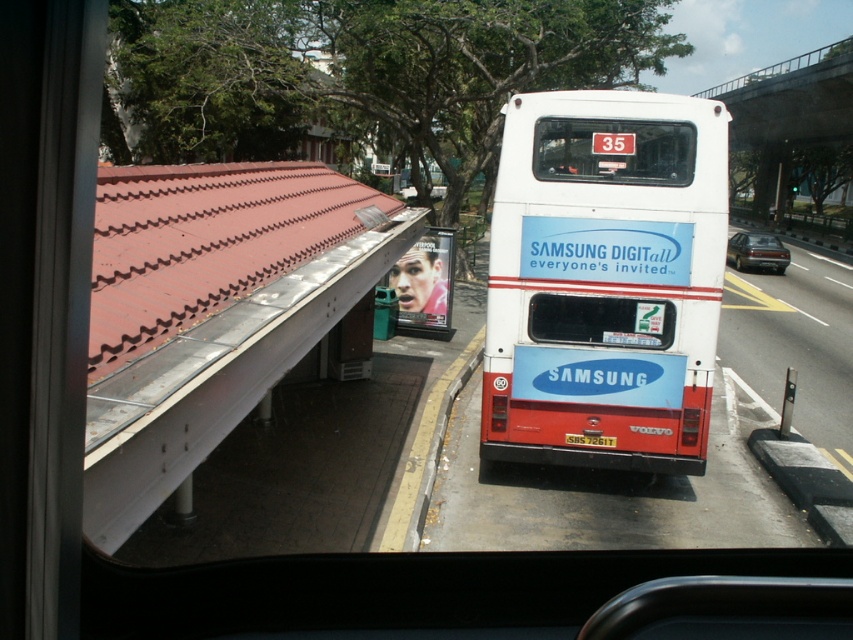
Looking at this image, you are a pedestrian standing at the bus stop and want to cross the road to reach the other side. There is a white glossy bus at right and a dark gray metallic sedan at right in your view. Given that the safe distance required for crossing is 10 meters, can you safely cross the road between these two vehicles?

The distance between the white glossy bus at right and the dark gray metallic sedan at right is 7.67 meters, which is less than the required 10 meters for safe crossing. Therefore, it is not safe to cross between them.

You are a pedestrian standing at the bus stop and want to cross the road to reach the concrete bridge at upper right. There is a dark gray metallic sedan at right parked on the same side as you. Can you safely walk around the car to reach the bridge?

The concrete bridge at upper right and dark gray metallic sedan at right are 23.95 meters apart, so yes, you can safely walk around the dark gray metallic sedan at right to reach the concrete bridge at upper right since the distance between them allows enough space for pedestrians to pass.

What is the relationship between the size of the dark gray metallic sedan at right and the yellow plastic license plate at rear center in the image?

The dark gray metallic sedan at right has a larger size compared to the yellow plastic license plate at rear center.